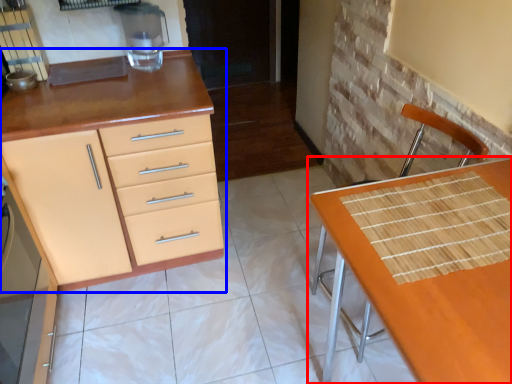
Question: Which point is further to the camera, table (highlighted by a red box) or cabinetry (highlighted by a blue box)?

Choices:
 (A) table
 (B) cabinetry

Answer: (B)